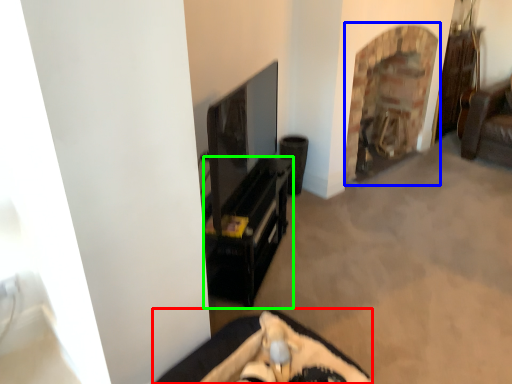
Question: Which object is the farthest from furniture (highlighted by a red box)? Choose among these: fireplace (highlighted by a blue box) or furniture (highlighted by a green box).

Choices:
 (A) fireplace
 (B) furniture

Answer: (A)